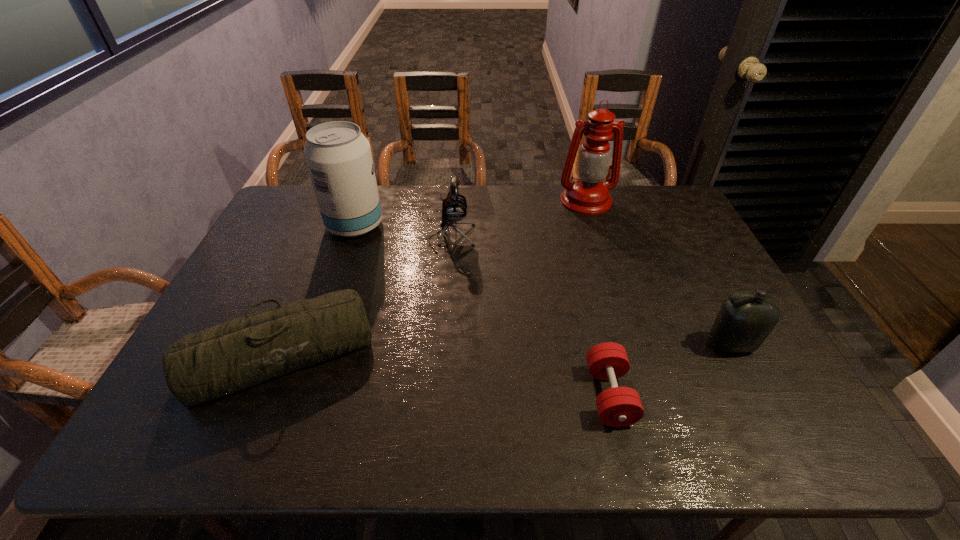
Where is `oil lamp`? This screenshot has height=540, width=960. oil lamp is located at coordinates (588, 195).

At what (x,y) coordinates should I click in order to perform the action: click on alcohol. Please return your answer as a coordinate pair (x, y). Looking at the image, I should click on (338, 156).

Where is `earphone`? earphone is located at coordinates (454, 208).

I want to click on bottle, so click(x=745, y=319).

Identify the location of duffel bag. (232, 356).

The height and width of the screenshot is (540, 960). In order to click on the shortest object in this screenshot , I will do click(x=618, y=406).

At what (x,y) coordinates should I click in order to perform the action: click on free region located on the front of the oil lamp. Please return your answer as a coordinate pair (x, y). Image resolution: width=960 pixels, height=540 pixels. Looking at the image, I should click on (594, 226).

The height and width of the screenshot is (540, 960). What are the coordinates of `free location located on the front of the alcohol` in the screenshot? It's located at (323, 318).

This screenshot has height=540, width=960. Find the location of `vacant space located on the right of the third object from left to right`. vacant space located on the right of the third object from left to right is located at coordinates (537, 238).

The width and height of the screenshot is (960, 540). I want to click on vacant space located on the left of the bottle, so click(635, 345).